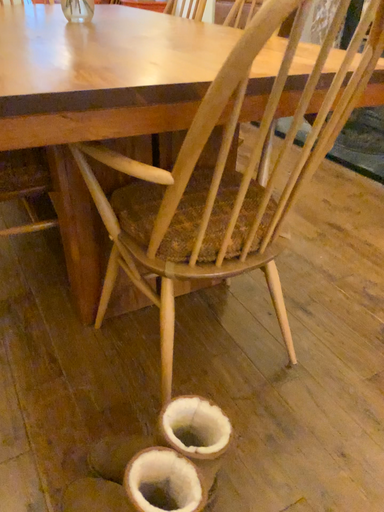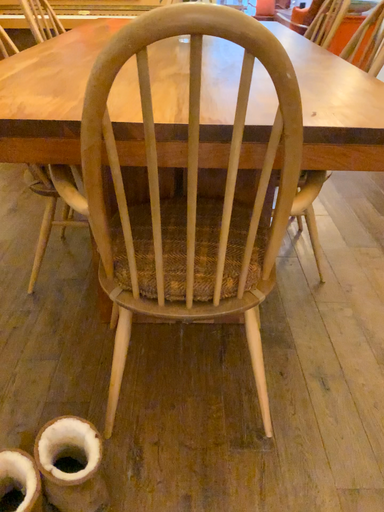
Question: How did the camera likely rotate when shooting the video?

Choices:
 (A) rotated left
 (B) rotated right

Answer: (A)